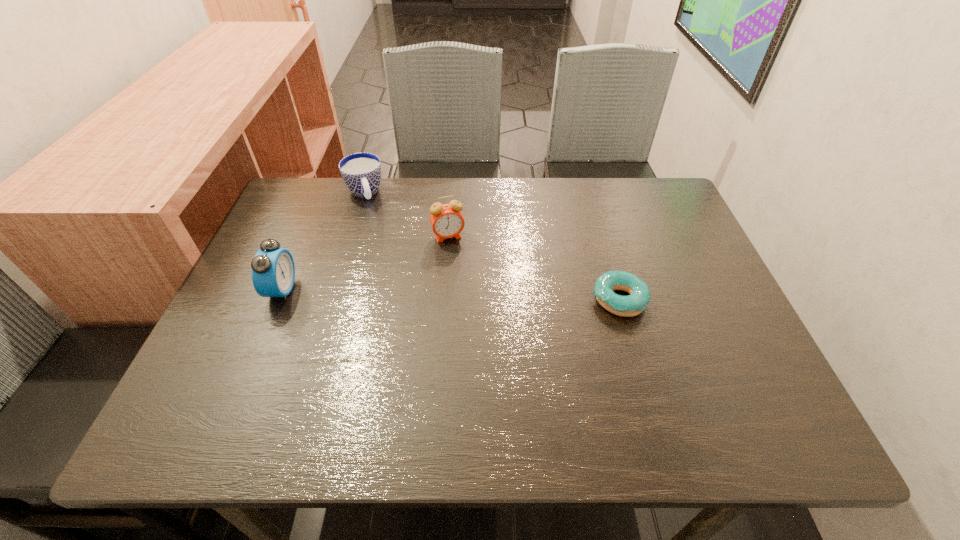
Where is `object at the far left corner`? object at the far left corner is located at coordinates (361, 172).

The width and height of the screenshot is (960, 540). In order to click on free space at the far edge in this screenshot , I will do `click(612, 210)`.

In the image, there is a desktop. At what (x,y) coordinates should I click in order to perform the action: click on vacant space at the near edge. Please return your answer as a coordinate pair (x, y). The width and height of the screenshot is (960, 540). Looking at the image, I should click on [x=518, y=358].

In the image, there is a desktop. Identify the location of vacant space at the left edge. The height and width of the screenshot is (540, 960). (301, 300).

Locate an element on the screen. This screenshot has height=540, width=960. vacant area at the right edge is located at coordinates (656, 249).

In the image, there is a desktop. Identify the location of vacant area at the near left corner. (202, 367).

The height and width of the screenshot is (540, 960). Find the location of `vacant area at the far right corner`. vacant area at the far right corner is located at coordinates (636, 224).

Identify the location of blank space at the near right corner of the desktop. (732, 397).

What are the coordinates of `unoccupied area between the right alarm clock and the leftmost object` in the screenshot? It's located at (365, 263).

This screenshot has width=960, height=540. In order to click on free spot between the right alarm clock and the leftmost object in this screenshot , I will do `click(365, 263)`.